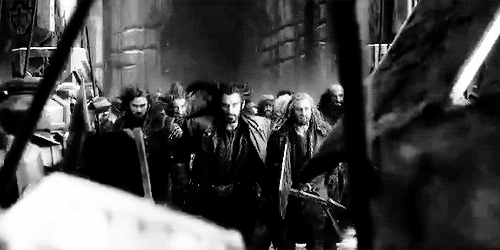
Where is `wall on right`? The width and height of the screenshot is (500, 250). wall on right is located at coordinates (262, 30).